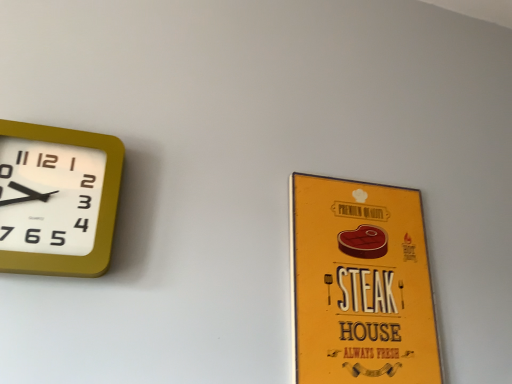
Where is `gold plastic wall clock at left`? The height and width of the screenshot is (384, 512). gold plastic wall clock at left is located at coordinates (57, 199).

This screenshot has width=512, height=384. Describe the element at coordinates (57, 199) in the screenshot. I see `gold plastic wall clock at left` at that location.

I want to click on gold plastic wall clock at left, so click(x=57, y=199).